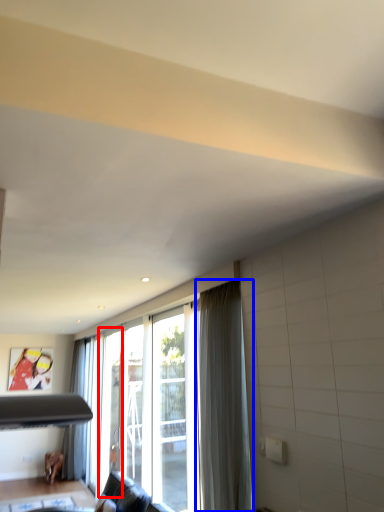
Question: Which object is closer to the camera taking this photo, screen door (highlighted by a red box) or curtain (highlighted by a blue box)?

Choices:
 (A) screen door
 (B) curtain

Answer: (B)